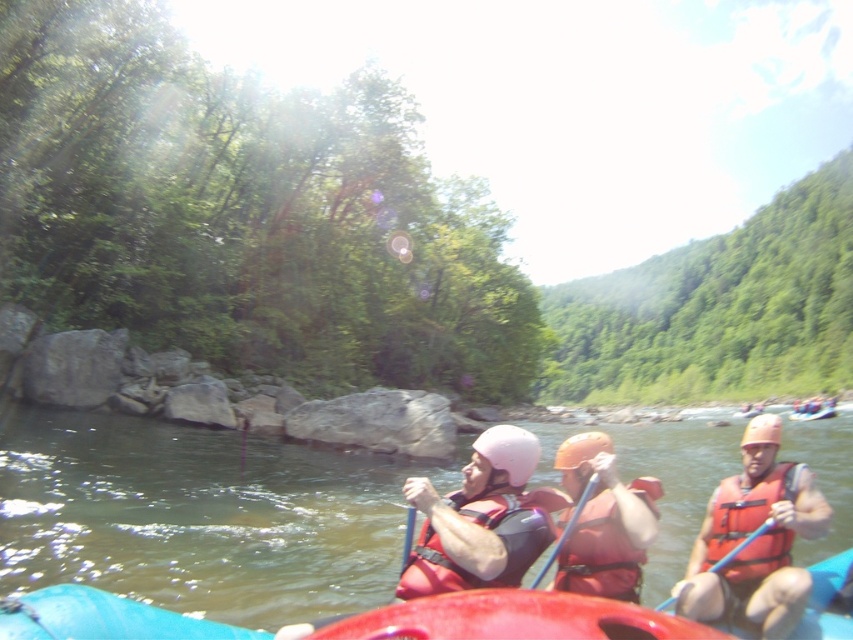
Question: Is green rubber raft at center above orange life jacket at center?

Choices:
 (A) yes
 (B) no

Answer: (B)

Question: Can you confirm if green rubber raft at center is positioned to the right of orange life jacket at center?

Choices:
 (A) yes
 (B) no

Answer: (A)

Question: Considering the relative positions of orange life jacket at center and blue plastic paddle at center in the image provided, where is orange life jacket at center located with respect to blue plastic paddle at center?

Choices:
 (A) left
 (B) right

Answer: (B)

Question: Which of these objects is positioned farthest from the green rubber raft at center?

Choices:
 (A) red matte life jacket at center
 (B) rubberized red canoe at center
 (C) blue plastic paddle at center

Answer: (A)

Question: Based on their relative distances, which object is nearer to the orange life vest at right?

Choices:
 (A) blue plastic paddle at center
 (B) orange life jacket at center
 (C) red life jacket at center

Answer: (B)

Question: Considering the real-world distances, which object is farthest from the red rubber canoe at right?

Choices:
 (A) orange life vest at right
 (B) blue plastic paddle at center
 (C) red life jacket at center

Answer: (C)